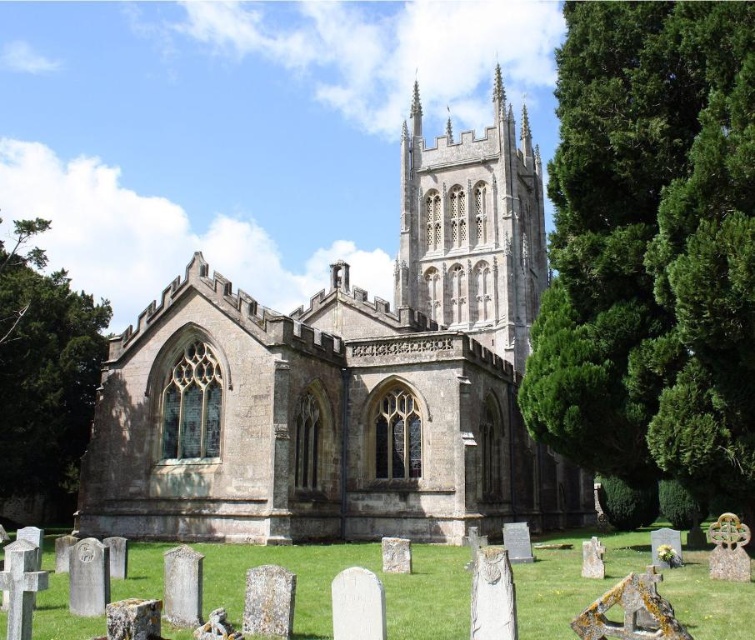
Question: Which point is closer to the camera?

Choices:
 (A) [529, 196]
 (B) [410, 116]
 (C) [624, 474]

Answer: (C)

Question: Can you confirm if stone church at center is positioned below green leafy tree at left?

Choices:
 (A) yes
 (B) no

Answer: (A)

Question: Can you confirm if stone gothic tower at center is smaller than green leafy tree at left?

Choices:
 (A) no
 (B) yes

Answer: (B)

Question: Does stone church at center come behind green coniferous tree at right?

Choices:
 (A) yes
 (B) no

Answer: (A)

Question: Which is farther from the green coniferous tree at right?

Choices:
 (A) stone gothic tower at center
 (B) smooth stone spire at upper center
 (C) stone church at center
 (D) green leafy tree at left

Answer: (B)

Question: Based on their relative distances, which object is nearer to the stone church at center?

Choices:
 (A) green coniferous tree at right
 (B) smooth stone spire at upper center
 (C) stone gothic tower at center

Answer: (C)